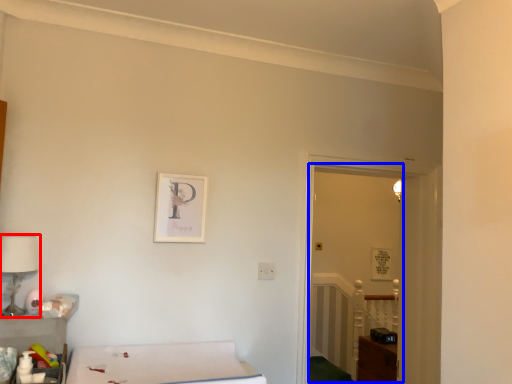
Question: Among these objects, which one is nearest to the camera, table lamp (highlighted by a red box) or glass door (highlighted by a blue box)?

Choices:
 (A) table lamp
 (B) glass door

Answer: (A)